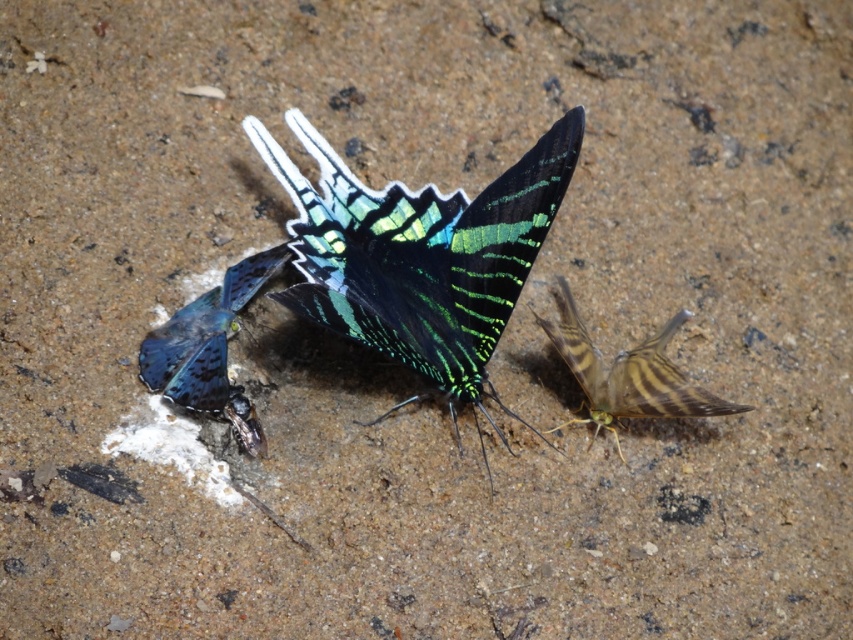
You are a child trying to catch the shiny metallic insect at center and the brown striped butterfly at right. If you can reach 18 inches, can you catch both insects at the same time?

The brown striped butterfly at right and the shiny metallic insect at center are 18.21 inches apart. Since your reach is 18 inches, you cannot catch both at the same time because the distance between them is slightly more than your reach.

You are a child who wants to catch both the shiny metallic butterfly at center and the shiny blue butterfly at left. You have a net that can reach up to 7 inches. Can you catch both butterflies with one throw of the net?

The shiny metallic butterfly at center is 7.41 inches away from the shiny blue butterfly at left. Since the net can only reach up to 7 inches, the distance between them is slightly more than the net can cover. Therefore, you cannot catch both butterflies with one throw of the net.

You are a photographer trying to capture the shiny metallic insect at center without the brown striped butterfly at right appearing in the background. Is this possible based on their positions?

The brown striped butterfly at right is in front of the shiny metallic insect at center, so it will block the view. To capture the shiny metallic insect at center without the brown striped butterfly at right in the background, you would need to adjust your angle or move the brown striped butterfly at right out of the way.